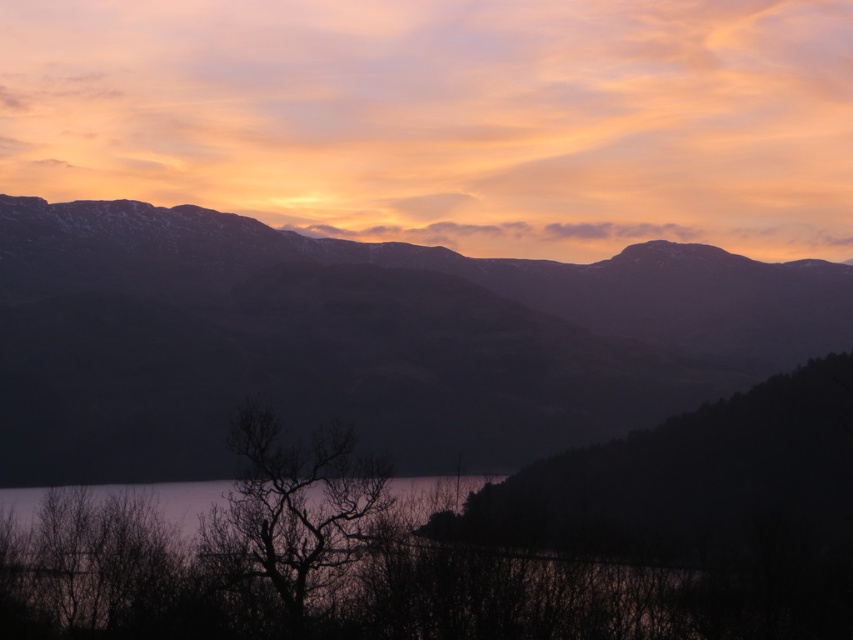
Consider the image. You are standing at the edge of the lake in the serene landscape scene. You notice two points marked in the image. Which point, point [430,346] or point [322,428], is closer to your position?

Point [322,428] is closer to your position because it is less further to the camera than point [430,346].

You are standing at the center of the image and want to walk towards the dark purple mountain range at center. Which direction should you head?

The dark purple mountain range at center is already at the center of the image, so you are already facing it. You can proceed straight ahead.